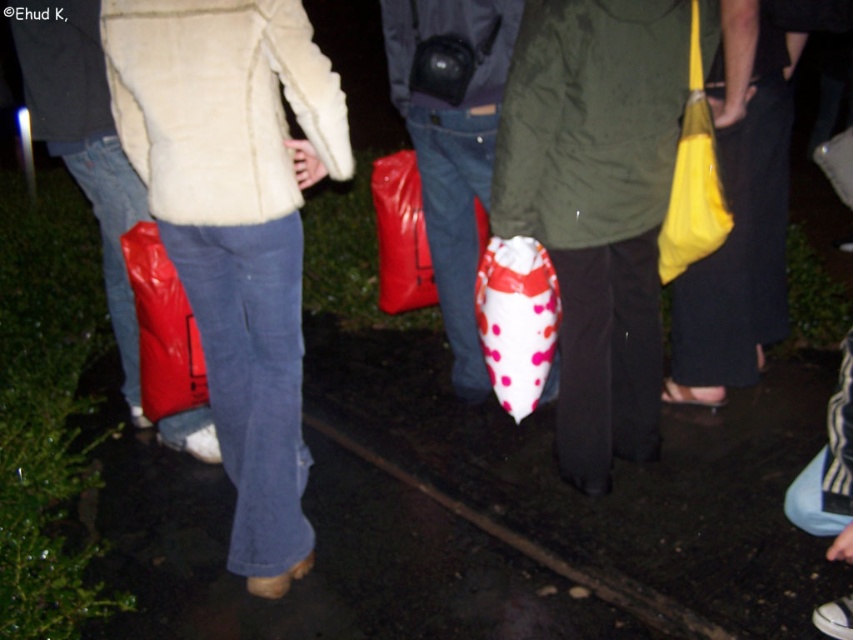
This screenshot has height=640, width=853. Describe the element at coordinates (515, 320) in the screenshot. I see `white dotted plastic bag at center` at that location.

Does white dotted plastic bag at center have a lesser width compared to matte red plastic bag at lower left?

In fact, white dotted plastic bag at center might be wider than matte red plastic bag at lower left.

Image resolution: width=853 pixels, height=640 pixels. Find the location of `white dotted plastic bag at center`. white dotted plastic bag at center is located at coordinates (515, 320).

Can you confirm if matte white jacket at center is wider than matte blue jeans at left?

Yes.

Can you confirm if matte white jacket at center is shorter than matte blue jeans at left?

In fact, matte white jacket at center may be taller than matte blue jeans at left.

Who is more forward, (271, 13) or (96, 109)?

Point (271, 13) is in front.

Locate an element on the screen. This screenshot has height=640, width=853. matte white jacket at center is located at coordinates (235, 227).

Which of these two, matte blue jeans at left or matte red plastic bag at center, stands shorter?

matte red plastic bag at center

Is point (70, 8) farther from viewer compared to point (383, 237)?

No.

I want to click on matte blue jeans at left, so click(83, 144).